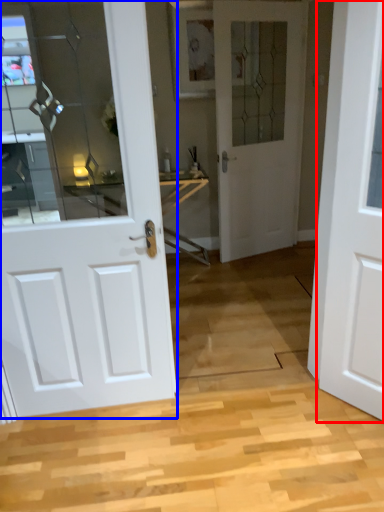
Question: Which of the following is the closest to the observer, door (highlighted by a red box) or door (highlighted by a blue box)?

Choices:
 (A) door
 (B) door

Answer: (A)